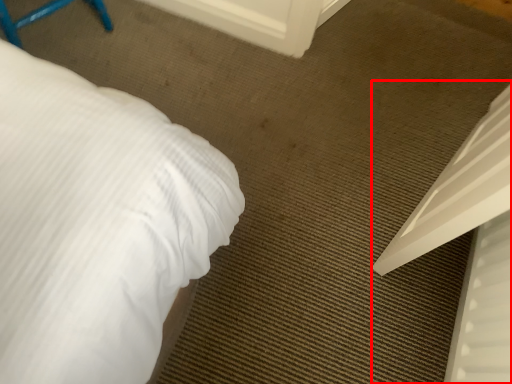
Question: From the image's perspective, considering the relative positions of bed (annotated by the red box) and screen door in the image provided, where is bed (annotated by the red box) located with respect to the staircase?

Choices:
 (A) below
 (B) above

Answer: (A)